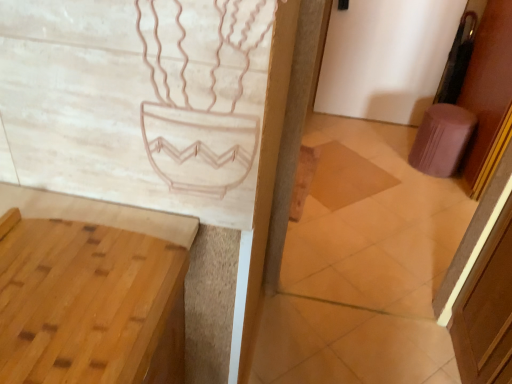
Question: Is pink fabric stool at right to the left of light brown wood vanity at lower left from the viewer's perspective?

Choices:
 (A) no
 (B) yes

Answer: (A)

Question: Can you confirm if pink fabric stool at right is shorter than light brown wood vanity at lower left?

Choices:
 (A) yes
 (B) no

Answer: (A)

Question: Is pink fabric stool at right positioned with its back to light brown wood vanity at lower left?

Choices:
 (A) no
 (B) yes

Answer: (A)

Question: Would you say pink fabric stool at right is a long distance from light brown wood vanity at lower left?

Choices:
 (A) yes
 (B) no

Answer: (A)

Question: Does pink fabric stool at right have a larger size compared to light brown wood vanity at lower left?

Choices:
 (A) no
 (B) yes

Answer: (A)

Question: Is pink fabric stool at right positioned before light brown wood vanity at lower left?

Choices:
 (A) no
 (B) yes

Answer: (A)

Question: Is light brown wood vanity at lower left not inside purple fabric door at right?

Choices:
 (A) no
 (B) yes

Answer: (B)

Question: Can you confirm if light brown wood vanity at lower left is positioned to the left of purple fabric door at right?

Choices:
 (A) yes
 (B) no

Answer: (A)

Question: Considering the relative sizes of light brown wood vanity at lower left and purple fabric door at right in the image provided, is light brown wood vanity at lower left taller than purple fabric door at right?

Choices:
 (A) yes
 (B) no

Answer: (B)

Question: Considering the relative sizes of light brown wood vanity at lower left and purple fabric door at right in the image provided, is light brown wood vanity at lower left smaller than purple fabric door at right?

Choices:
 (A) no
 (B) yes

Answer: (A)

Question: Does light brown wood vanity at lower left have a larger size compared to purple fabric door at right?

Choices:
 (A) no
 (B) yes

Answer: (B)

Question: Is light brown wood vanity at lower left directly adjacent to purple fabric door at right?

Choices:
 (A) no
 (B) yes

Answer: (A)

Question: Is brown wood screen door at right further to camera compared to pink fabric stool at right?

Choices:
 (A) no
 (B) yes

Answer: (A)